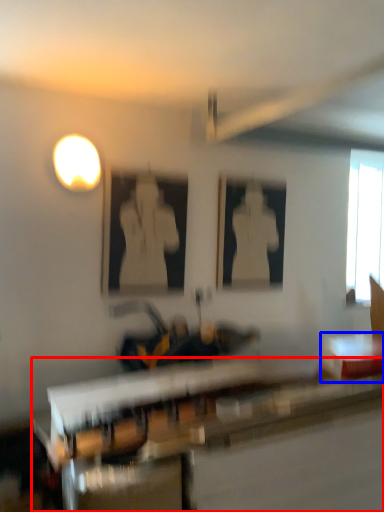
Question: Which object appears farthest to the camera in this image, table (highlighted by a red box) or table (highlighted by a blue box)?

Choices:
 (A) table
 (B) table

Answer: (B)